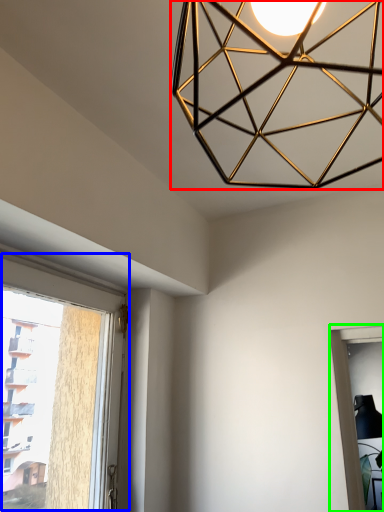
Question: Estimate the real-world distances between objects in this image. Which object is farther from lamp (highlighted by a red box), window (highlighted by a blue box) or window (highlighted by a green box)?

Choices:
 (A) window
 (B) window

Answer: (B)